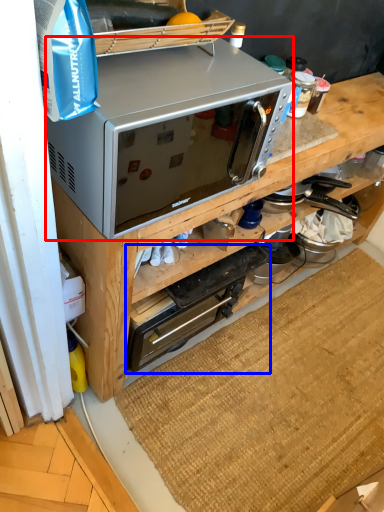
Question: Which object is further to the camera taking this photo, microwave oven (highlighted by a red box) or appliance (highlighted by a blue box)?

Choices:
 (A) microwave oven
 (B) appliance

Answer: (B)